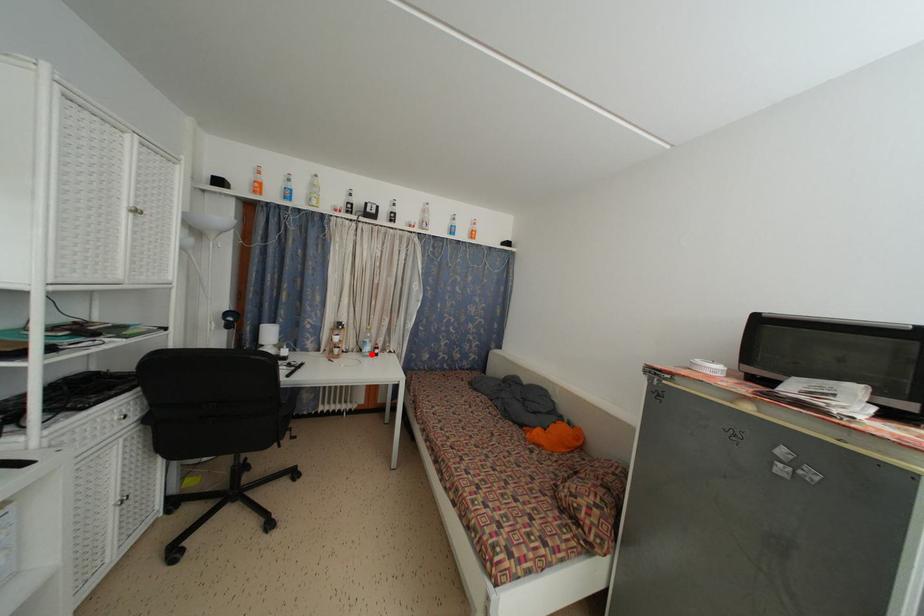
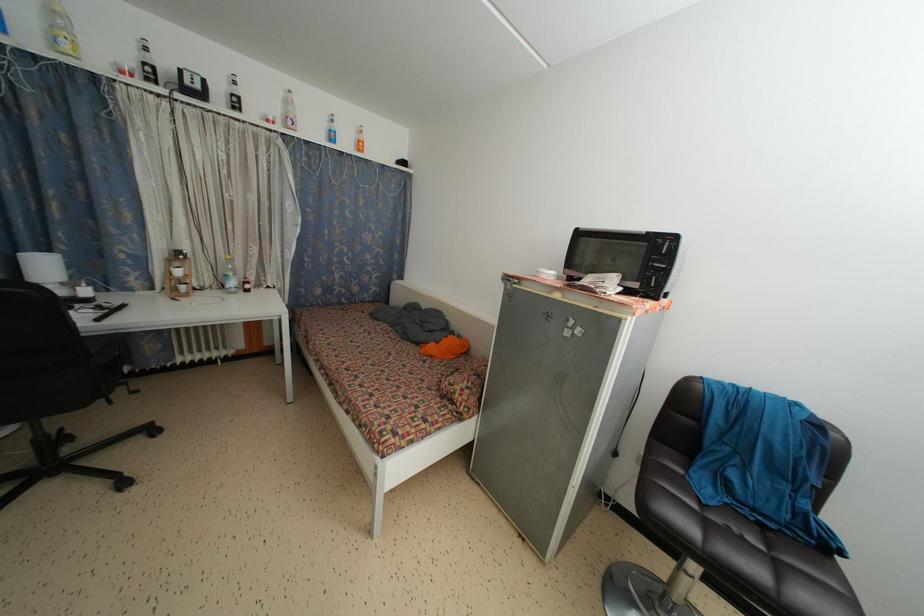
Locate, in the second image, the point that corresponds to the highlighted location in the first image.

(237, 289)